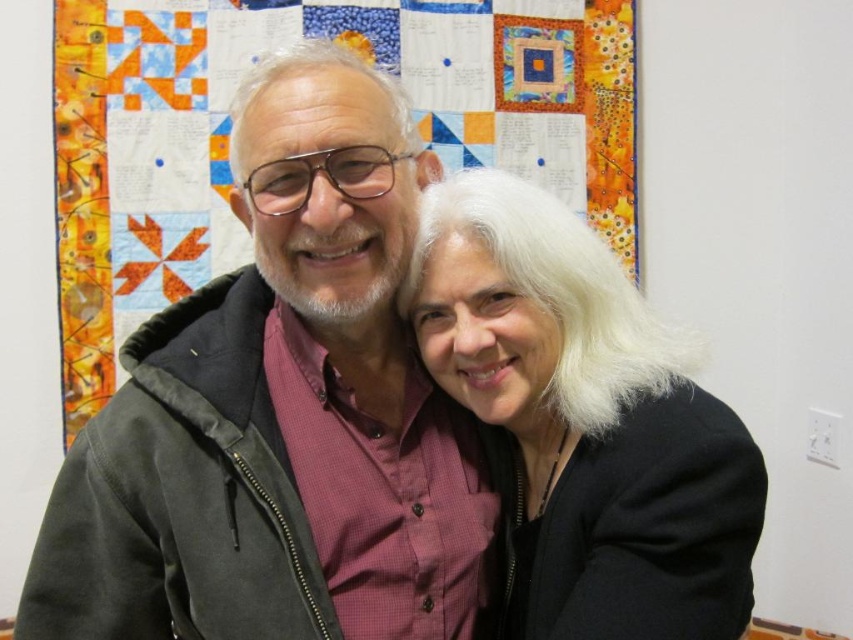
You are a photographer adjusting the lighting in the studio. You notice the matte black jacket at center and the white matte hair at center. Which object should you focus on to ensure proper exposure, considering their positions?

The matte black jacket at center is positioned over white matte hair at center, so focusing on the matte black jacket at center would ensure proper exposure as it is closer to the light source.

From the picture: You are standing at the camera position looking at the scene. There is a point marked at coordinates point (404, 522). If you want to touch this point with a 30 inch long stick, will the stick be long enough?

The point (404, 522) is 34.58 inches away from the camera. Since the stick is only 30 inches long, it will not be long enough to reach the point.